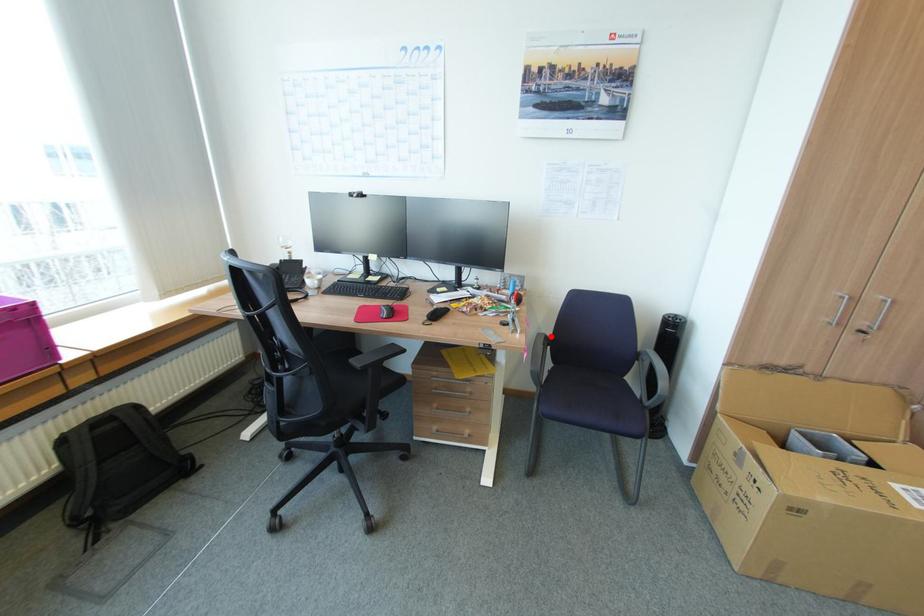
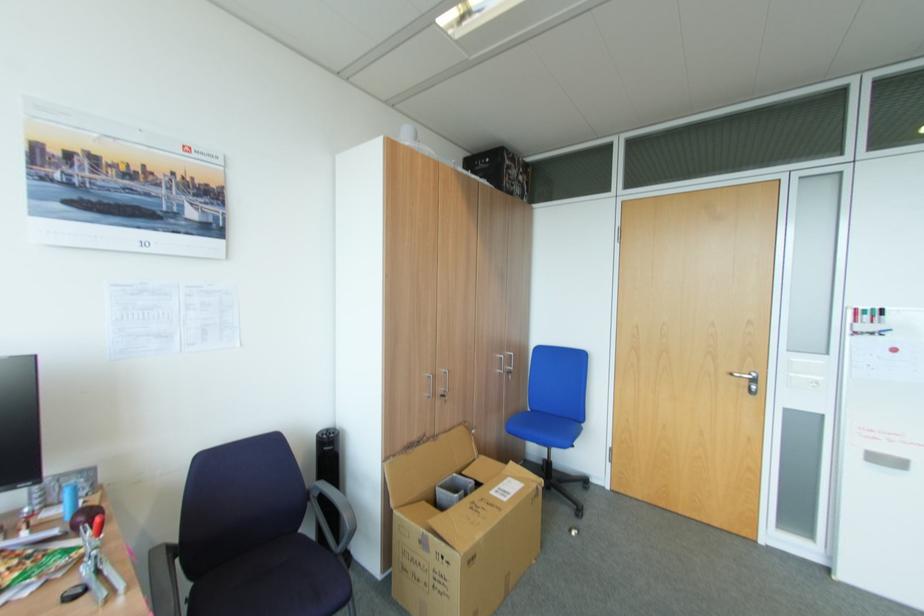
Question: A red point is marked in image1. In image2, is the corresponding 3D point closer to the camera or farther? Reply with the corresponding letter.

Choices:
 (A) The corresponding 3D point is closer.
 (B) The corresponding 3D point is farther.

Answer: (B)